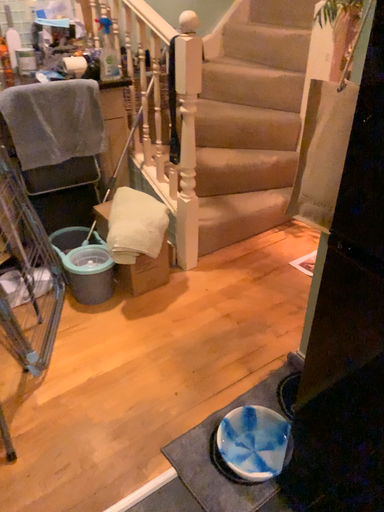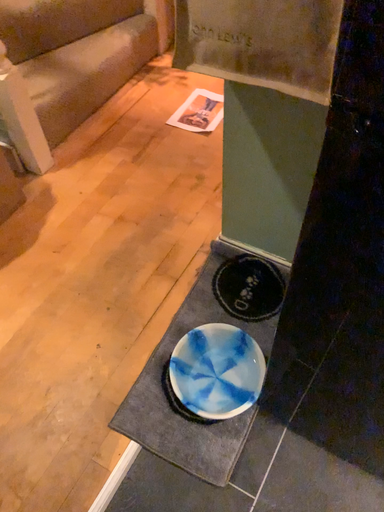
Question: Which way did the camera rotate in the video?

Choices:
 (A) rotated right
 (B) rotated left

Answer: (A)